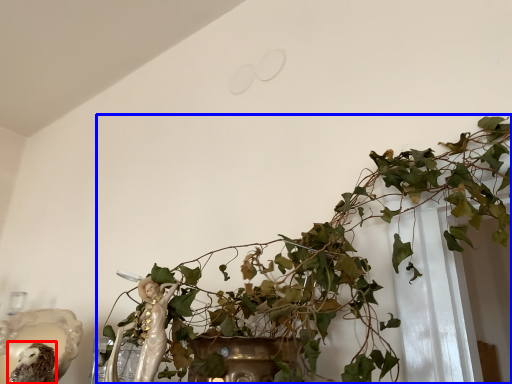
Question: Which object is further to the camera taking this photo, animal (highlighted by a red box) or houseplant (highlighted by a blue box)?

Choices:
 (A) animal
 (B) houseplant

Answer: (A)